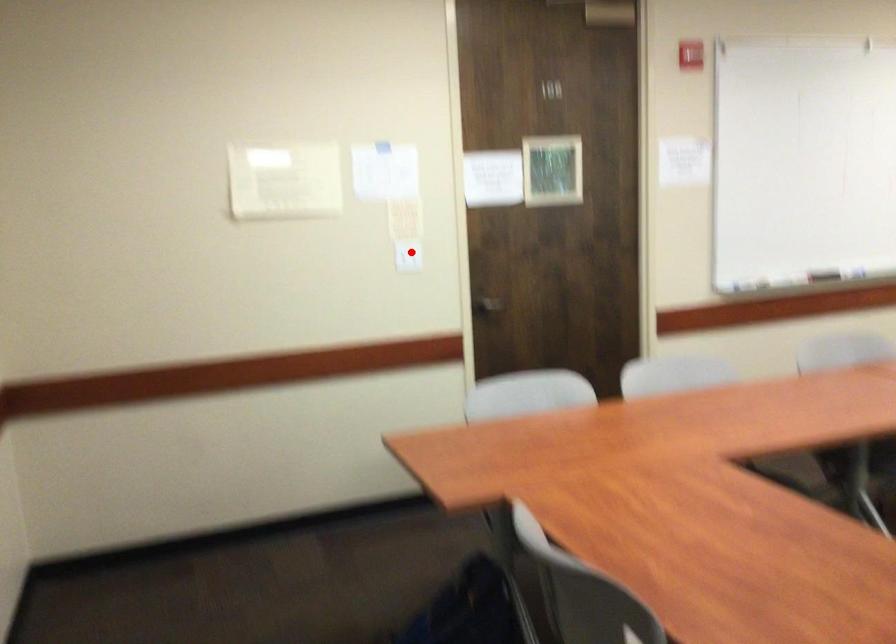
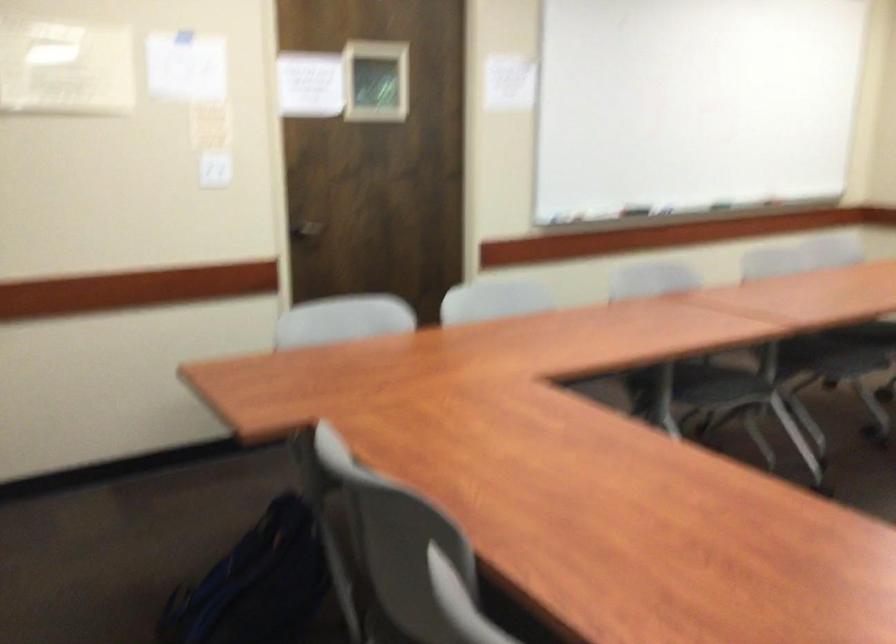
Question: A red point is marked in image1. In image2, is the corresponding 3D point closer to the camera or farther? Reply with the corresponding letter.

Choices:
 (A) The corresponding 3D point is closer.
 (B) The corresponding 3D point is farther.

Answer: (A)